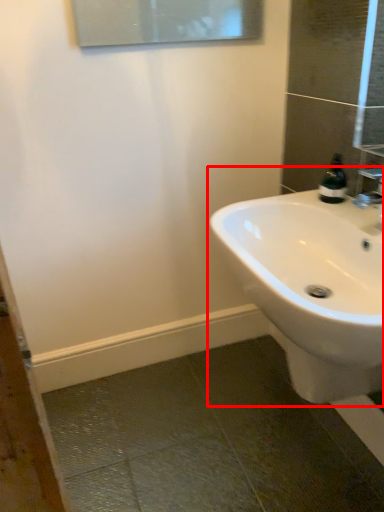
Question: Considering the relative positions of sink (annotated by the red box) and soap dispenser in the image provided, where is sink (annotated by the red box) located with respect to the staircase?

Choices:
 (A) left
 (B) right

Answer: (A)